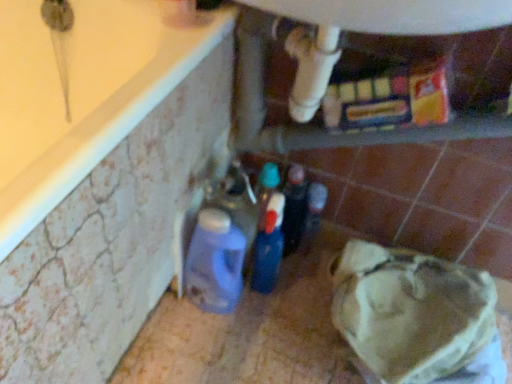
The image size is (512, 384). Identify the location of vacant area that is in front of translucent plastic bottle at center, the 1th bottle viewed from the right. (294, 303).